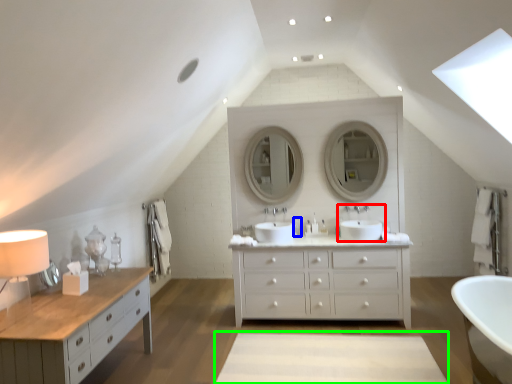
Question: Estimate the real-world distances between objects in this image. Which object is closer to sink (highlighted by a red box), toiletry (highlighted by a blue box) or plain (highlighted by a green box)?

Choices:
 (A) toiletry
 (B) plain

Answer: (A)